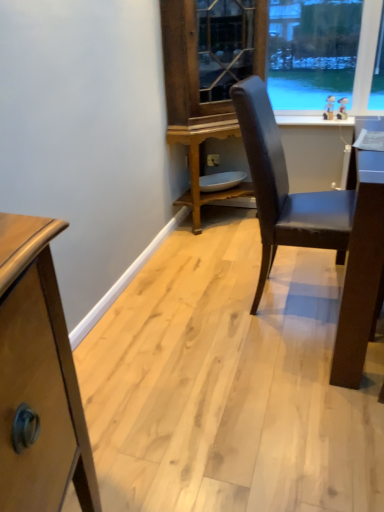
Locate an element on the screen. The height and width of the screenshot is (512, 384). vacant space in front of matte black chair at center is located at coordinates (285, 379).